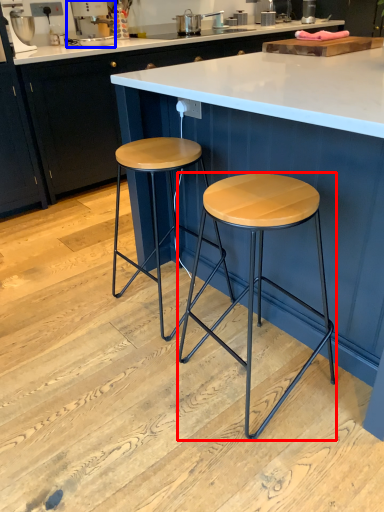
Question: Among these objects, which one is farthest to the camera, stool (highlighted by a red box) or appliance (highlighted by a blue box)?

Choices:
 (A) stool
 (B) appliance

Answer: (B)